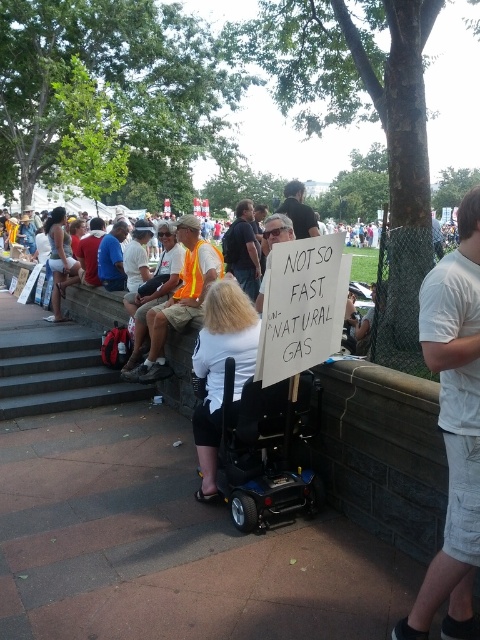
Is white cotton t-shirt at right taller than white plastic sign at center?

Correct, white cotton t-shirt at right is much taller as white plastic sign at center.

Does point (478, 522) lie in front of point (261, 300)?

Yes.

In order to click on white cotton t-shirt at right in this screenshot , I will do `click(454, 428)`.

Can you confirm if white cotton t-shirt at right is shorter than dark blue shirt at center?

Incorrect, white cotton t-shirt at right's height does not fall short of dark blue shirt at center's.

Can you confirm if white cotton t-shirt at right is positioned to the right of dark blue shirt at center?

Indeed, white cotton t-shirt at right is positioned on the right side of dark blue shirt at center.

Is point (421, 308) behind point (226, 237)?

No, it is not.

Identify the location of white cotton t-shirt at right. The width and height of the screenshot is (480, 640). coord(454,428).

Can you confirm if black plastic wheelchair at center is smaller than dark blue shirt at center?

Indeed, black plastic wheelchair at center has a smaller size compared to dark blue shirt at center.

Who is more forward, (238, 516) or (251, 262)?

Point (238, 516) is more forward.

Which is in front, point (283, 513) or point (240, 204)?

Point (283, 513)

Identify the location of black plastic wheelchair at center. tap(266, 451).